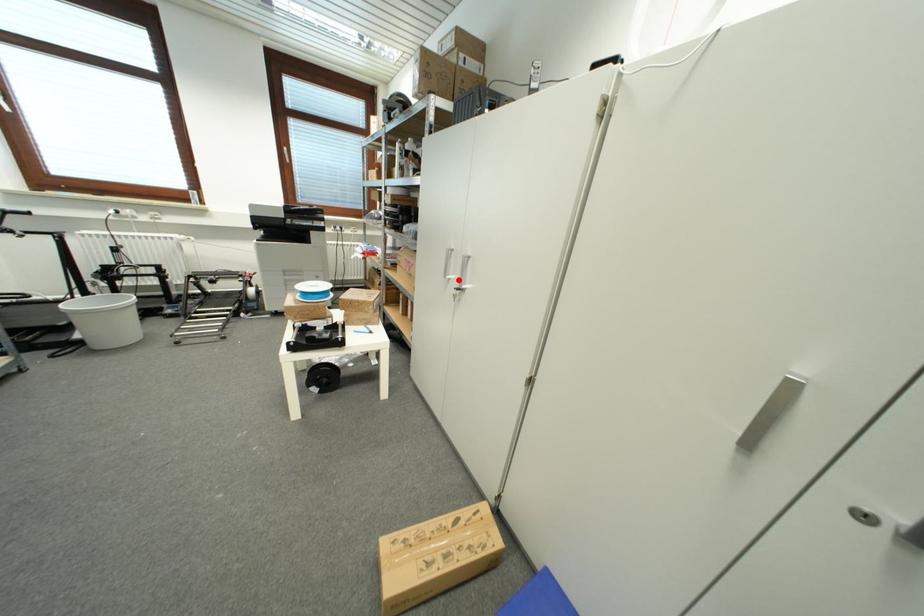
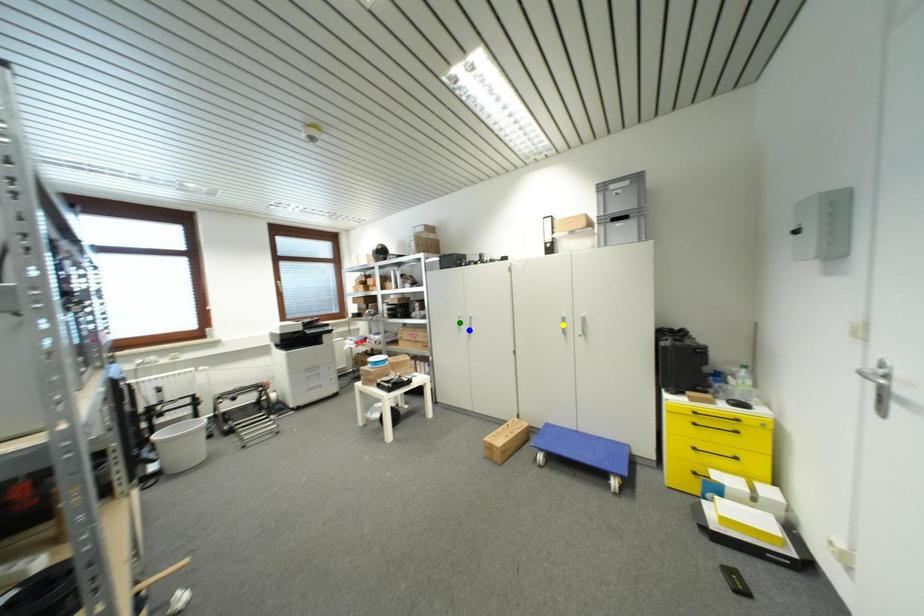
Question: I am providing you with two images of the same scene from different viewpoints. A red point is marked on the first image. You are given multiple points on the second image. Which spot in image 2 lines up with the point in image 1?

Choices:
 (A) green point
 (B) blue point
 (C) yellow point

Answer: (B)